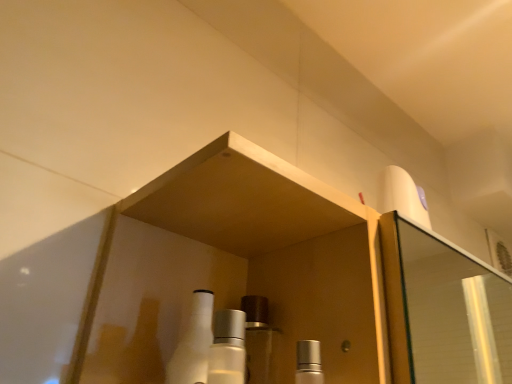
Where is `satin silver cap at center, which is the 1th mouthwash in right-to-left order`? This screenshot has width=512, height=384. satin silver cap at center, which is the 1th mouthwash in right-to-left order is located at coordinates (309, 363).

Describe the element at coordinates (309, 363) in the screenshot. I see `satin silver cap at center, which is the 1th mouthwash in right-to-left order` at that location.

Identify the location of white glossy bottle at center. (193, 343).

Measure the distance between point [224,343] and camera.

Point [224,343] and camera are 12.87 inches apart from each other.

This screenshot has height=384, width=512. Find the location of `satin silver bottle at center, the 2th mouthwash from the right`. satin silver bottle at center, the 2th mouthwash from the right is located at coordinates (227, 348).

Where is `satin silver cap at center, which is the 1th mouthwash in right-to-left order`? The image size is (512, 384). satin silver cap at center, which is the 1th mouthwash in right-to-left order is located at coordinates (309, 363).

Considering the positions of point (238, 338) and point (301, 362), is point (238, 338) closer or farther from the camera than point (301, 362)?

Point (238, 338) is positioned closer to the camera compared to point (301, 362).

Considering the sizes of satin silver bottle at center, the 2th mouthwash from the right, and satin silver cap at center, positioned as the 2th mouthwash in left-to-right order, in the image, is satin silver bottle at center, the 2th mouthwash from the right, taller or shorter than satin silver cap at center, positioned as the 2th mouthwash in left-to-right order,?

Considering their sizes, satin silver bottle at center, the 2th mouthwash from the right, has more height than satin silver cap at center, positioned as the 2th mouthwash in left-to-right order.

From the picture: Is satin silver bottle at center, the 2th mouthwash from the right, looking in the opposite direction of satin silver cap at center, positioned as the 2th mouthwash in left-to-right order?

No, satin silver cap at center, positioned as the 2th mouthwash in left-to-right order, is not at the back of satin silver bottle at center, the 2th mouthwash from the right.

Considering the relative positions of satin silver cap at center, positioned as the 2th mouthwash in left-to-right order, and white glossy bottle at center in the image provided, is satin silver cap at center, positioned as the 2th mouthwash in left-to-right order, to the right of white glossy bottle at center from the viewer's perspective?

Correct, you'll find satin silver cap at center, positioned as the 2th mouthwash in left-to-right order, to the right of white glossy bottle at center.

Would you say satin silver cap at center, which is the 1th mouthwash in right-to-left order, is inside or outside white glossy bottle at center?

satin silver cap at center, which is the 1th mouthwash in right-to-left order, is outside white glossy bottle at center.

From the image's perspective, is satin silver cap at center, positioned as the 2th mouthwash in left-to-right order, above or below white glossy bottle at center?

Based on their image positions, satin silver cap at center, positioned as the 2th mouthwash in left-to-right order, is located beneath white glossy bottle at center.

You are a GUI agent. You are given a task and a screenshot of the screen. Output one action in this format:
    pyautogui.click(x=<x>, y=<y>)
    Task: Click on the bottle above the satin silver cap at center, positioned as the 2th mouthwash in left-to-right order (from a real-world perspective)
    
    Given the screenshot: What is the action you would take?
    pyautogui.click(x=193, y=343)

From a real-world perspective, is satin silver bottle at center, the 2th mouthwash from the right, on top of white glossy bottle at center?

Actually, satin silver bottle at center, the 2th mouthwash from the right, is physically below white glossy bottle at center in the real world.

Considering the positions of point (211, 375) and point (208, 317), is point (211, 375) closer or farther from the camera than point (208, 317)?

Point (211, 375).

Does satin silver bottle at center, the first mouthwash in the left-to-right sequence, have a lesser height compared to white glossy bottle at center?

Correct, satin silver bottle at center, the first mouthwash in the left-to-right sequence, is not as tall as white glossy bottle at center.

Is satin silver bottle at center, the first mouthwash in the left-to-right sequence, located outside white glossy bottle at center?

Yes, satin silver bottle at center, the first mouthwash in the left-to-right sequence, is outside of white glossy bottle at center.

Is white glossy bottle at center positioned with its back to satin silver cap at center, which is the 1th mouthwash in right-to-left order?

white glossy bottle at center is not turned away from satin silver cap at center, which is the 1th mouthwash in right-to-left order.

Consider the image. From a real-world perspective, is white glossy bottle at center on top of satin silver cap at center, positioned as the 2th mouthwash in left-to-right order?

Yes, from a real-world perspective, white glossy bottle at center is over satin silver cap at center, positioned as the 2th mouthwash in left-to-right order

From the image's perspective, is white glossy bottle at center over satin silver cap at center, which is the 1th mouthwash in right-to-left order?

Yes, from the image's perspective, white glossy bottle at center is on top of satin silver cap at center, which is the 1th mouthwash in right-to-left order.

Which is more to the left, white glossy bottle at center or satin silver cap at center, which is the 1th mouthwash in right-to-left order?

From the viewer's perspective, white glossy bottle at center appears more on the left side.

Is satin silver cap at center, which is the 1th mouthwash in right-to-left order, situated inside satin silver bottle at center, the first mouthwash in the left-to-right sequence, or outside?

satin silver cap at center, which is the 1th mouthwash in right-to-left order, is spatially situated outside satin silver bottle at center, the first mouthwash in the left-to-right sequence.

From the image's perspective, between satin silver cap at center, which is the 1th mouthwash in right-to-left order, and satin silver bottle at center, the 2th mouthwash from the right, who is located below?

satin silver cap at center, which is the 1th mouthwash in right-to-left order.

Is satin silver cap at center, positioned as the 2th mouthwash in left-to-right order, positioned in front of satin silver bottle at center, the 2th mouthwash from the right?

No, satin silver cap at center, positioned as the 2th mouthwash in left-to-right order, is further to the viewer.

Which is farther, (298, 370) or (222, 329)?

The point (298, 370) is farther.

From a real-world perspective, does white glossy bottle at center stand above satin silver bottle at center, the 2th mouthwash from the right?

Yes.

Is white glossy bottle at center in front of satin silver bottle at center, the 2th mouthwash from the right?

That is False.

Could you tell me if white glossy bottle at center is facing satin silver bottle at center, the 2th mouthwash from the right?

Yes, white glossy bottle at center faces towards satin silver bottle at center, the 2th mouthwash from the right.

Does white glossy bottle at center have a greater width compared to satin silver bottle at center, the 2th mouthwash from the right?

Correct, the width of white glossy bottle at center exceeds that of satin silver bottle at center, the 2th mouthwash from the right.

Find the location of a particular element. mouthwash behind the satin silver bottle at center, the first mouthwash in the left-to-right sequence is located at coordinates [x=309, y=363].

This screenshot has width=512, height=384. What are the coordinates of `mouthwash lying below the white glossy bottle at center (from the image's perspective)` in the screenshot? It's located at (309, 363).

Based on their spatial positions, is satin silver bottle at center, the 2th mouthwash from the right, or satin silver cap at center, positioned as the 2th mouthwash in left-to-right order, closer to white glossy bottle at center?

The object closer to white glossy bottle at center is satin silver bottle at center, the 2th mouthwash from the right.

Consider the image. Looking at the image, which one is located closer to satin silver bottle at center, the first mouthwash in the left-to-right sequence, satin silver cap at center, positioned as the 2th mouthwash in left-to-right order, or white glossy bottle at center?

Among the two, white glossy bottle at center is located nearer to satin silver bottle at center, the first mouthwash in the left-to-right sequence.

Looking at the image, which one is located further to satin silver bottle at center, the first mouthwash in the left-to-right sequence, white glossy bottle at center or satin silver cap at center, which is the 1th mouthwash in right-to-left order?

satin silver cap at center, which is the 1th mouthwash in right-to-left order, is further to satin silver bottle at center, the first mouthwash in the left-to-right sequence.

Which object lies nearer to the anchor point satin silver cap at center, positioned as the 2th mouthwash in left-to-right order, satin silver bottle at center, the 2th mouthwash from the right, or white glossy bottle at center?

The object closer to satin silver cap at center, positioned as the 2th mouthwash in left-to-right order, is satin silver bottle at center, the 2th mouthwash from the right.

Looking at the image, which one is located further to satin silver cap at center, positioned as the 2th mouthwash in left-to-right order, white glossy bottle at center or satin silver bottle at center, the 2th mouthwash from the right?

white glossy bottle at center is further to satin silver cap at center, positioned as the 2th mouthwash in left-to-right order.

Looking at the image, which one is located closer to white glossy bottle at center, satin silver cap at center, which is the 1th mouthwash in right-to-left order, or satin silver bottle at center, the first mouthwash in the left-to-right sequence?

The object closer to white glossy bottle at center is satin silver bottle at center, the first mouthwash in the left-to-right sequence.

The image size is (512, 384). What are the coordinates of `mouthwash located between white glossy bottle at center and satin silver cap at center, which is the 1th mouthwash in right-to-left order, in the left-right direction` in the screenshot? It's located at (227, 348).